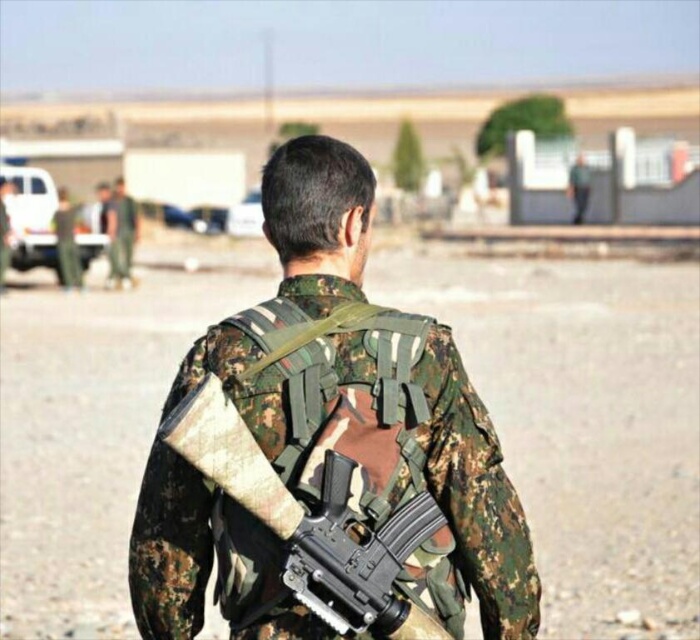
You are a photographer trying to capture the soldier in the desert scene. You notice the camouflage fabric backpack at center and the camouflage uniform at center. Which object should you focus on first if you want to photograph the one that is closer to the camera?

The camouflage fabric backpack at center is in front of the camouflage uniform at center, so you should focus on the camouflage fabric backpack at center first as it is closer to the camera.

You are a drone operator controlling a drone hovering above the desert scene. You need to deliver a critical message to the soldier wearing the camouflage uniform at center. There is a camouflage fabric backpack at center in the way. Can your drone safely fly between them without hitting anything?

The distance between the camouflage fabric backpack at center and the camouflage uniform at center is 33.91 meters, so yes, the drone can safely fly between them as there is sufficient space.

You are a soldier in the desert. You have a camouflage fabric backpack at center and a camouflage fabric gun at back. Which item is taller?

The camouflage fabric backpack at center is taller than the camouflage fabric gun at back.